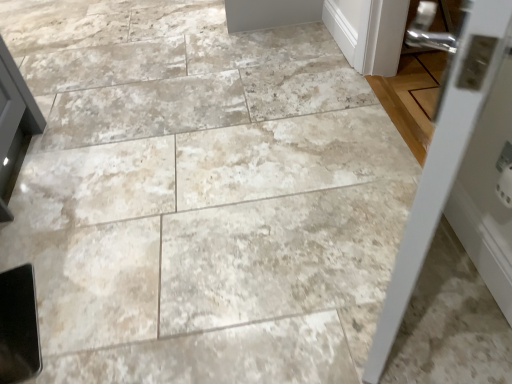
This screenshot has width=512, height=384. In order to click on white glossy door at right, the first door from the front in this screenshot , I will do `click(463, 172)`.

Measure the distance between point (455, 160) and camera.

Point (455, 160) is 19.33 inches from camera.

What do you see at coordinates (463, 172) in the screenshot?
I see `white glossy door at right, the first door from the front` at bounding box center [463, 172].

This screenshot has height=384, width=512. Describe the element at coordinates (349, 27) in the screenshot. I see `white painted wood door at upper right, which is counted as the 2th door, starting from the bottom` at that location.

Find the location of `white painted wood door at upper right, positioned as the 1th door in back-to-front order`. white painted wood door at upper right, positioned as the 1th door in back-to-front order is located at coordinates (349, 27).

Looking at this image, measure the distance between point (349, 0) and camera.

6.67 feet.

At what (x,y) coordinates should I click in order to perform the action: click on white glossy door at right, the 2th door in the back-to-front sequence. Please return your answer as a coordinate pair (x, y). Looking at the image, I should click on (463, 172).

Considering the relative positions of white glossy door at right, which is the second door from top to bottom, and white painted wood door at upper right, arranged as the 1th door when viewed from the top, in the image provided, is white glossy door at right, which is the second door from top to bottom, to the right of white painted wood door at upper right, arranged as the 1th door when viewed from the top, from the viewer's perspective?

No, white glossy door at right, which is the second door from top to bottom, is not to the right of white painted wood door at upper right, arranged as the 1th door when viewed from the top.

Is white glossy door at right, which is the second door from top to bottom, positioned before white painted wood door at upper right, which is the second door from front to back?

Yes, the depth of white glossy door at right, which is the second door from top to bottom, is less than that of white painted wood door at upper right, which is the second door from front to back.

Does point (469, 26) appear closer or farther from the camera than point (361, 53)?

Point (469, 26) is closer to the camera than point (361, 53).

From the image's perspective, is white glossy door at right, which is the second door from top to bottom, above or below white painted wood door at upper right, positioned as the 1th door in back-to-front order?

Based on their image positions, white glossy door at right, which is the second door from top to bottom, is located beneath white painted wood door at upper right, positioned as the 1th door in back-to-front order.

Consider the image. From a real-world perspective, relative to white painted wood door at upper right, arranged as the 1th door when viewed from the top, is white glossy door at right, acting as the first door starting from the bottom, vertically above or below?

Clearly, from a real-world perspective, white glossy door at right, acting as the first door starting from the bottom, is above white painted wood door at upper right, arranged as the 1th door when viewed from the top.

Considering the relative sizes of white glossy door at right, acting as the first door starting from the bottom, and white painted wood door at upper right, which is counted as the 2th door, starting from the bottom, in the image provided, is white glossy door at right, acting as the first door starting from the bottom, wider than white painted wood door at upper right, which is counted as the 2th door, starting from the bottom,?

Indeed, white glossy door at right, acting as the first door starting from the bottom, has a greater width compared to white painted wood door at upper right, which is counted as the 2th door, starting from the bottom.

Considering the relative sizes of white glossy door at right, acting as the first door starting from the bottom, and white painted wood door at upper right, which is the second door from front to back, in the image provided, is white glossy door at right, acting as the first door starting from the bottom, taller than white painted wood door at upper right, which is the second door from front to back,?

Yes, white glossy door at right, acting as the first door starting from the bottom, is taller than white painted wood door at upper right, which is the second door from front to back.

Considering the relative sizes of white glossy door at right, which is the second door from top to bottom, and white painted wood door at upper right, which is counted as the 2th door, starting from the bottom, in the image provided, is white glossy door at right, which is the second door from top to bottom, bigger than white painted wood door at upper right, which is counted as the 2th door, starting from the bottom,?

Yes.

Is white glossy door at right, acting as the first door starting from the bottom, outside of white painted wood door at upper right, which is the second door from front to back?

Yes.

Looking at this image, is white glossy door at right, which is the second door from top to bottom, far away from white painted wood door at upper right, positioned as the 1th door in back-to-front order?

Yes, white glossy door at right, which is the second door from top to bottom, and white painted wood door at upper right, positioned as the 1th door in back-to-front order, are quite far apart.

Does white glossy door at right, the 2th door in the back-to-front sequence, turn towards white painted wood door at upper right, positioned as the 1th door in back-to-front order?

No, white glossy door at right, the 2th door in the back-to-front sequence, is not facing towards white painted wood door at upper right, positioned as the 1th door in back-to-front order.

How many degrees apart are the facing directions of white glossy door at right, which is the second door from top to bottom, and white painted wood door at upper right, arranged as the 1th door when viewed from the top?

31.2 degrees separate the facing orientations of white glossy door at right, which is the second door from top to bottom, and white painted wood door at upper right, arranged as the 1th door when viewed from the top.

Could you measure the distance between white glossy door at right, which is the second door from top to bottom, and white painted wood door at upper right, positioned as the 1th door in back-to-front order?

The distance of white glossy door at right, which is the second door from top to bottom, from white painted wood door at upper right, positioned as the 1th door in back-to-front order, is 3.72 feet.

This screenshot has width=512, height=384. Identify the location of door positioned vertically above the white painted wood door at upper right, positioned as the 1th door in back-to-front order (from a real-world perspective). (463, 172).

Can you confirm if white painted wood door at upper right, arranged as the 1th door when viewed from the top, is positioned to the right of white glossy door at right, the 2th door in the back-to-front sequence?

Yes.

Which object is further away from the camera taking this photo, white painted wood door at upper right, arranged as the 1th door when viewed from the top, or white glossy door at right, which is the second door from top to bottom?

white painted wood door at upper right, arranged as the 1th door when viewed from the top, is more distant.

Considering the points (361, 18) and (485, 210), which point is in front, point (361, 18) or point (485, 210)?

The point (485, 210) is closer to the camera.

From the image's perspective, is white painted wood door at upper right, positioned as the 1th door in back-to-front order, below white glossy door at right, which is the second door from top to bottom?

No.

From a real-world perspective, does white painted wood door at upper right, which is counted as the 2th door, starting from the bottom, stand above white glossy door at right, acting as the first door starting from the bottom?

No, from a real-world perspective, white painted wood door at upper right, which is counted as the 2th door, starting from the bottom, is not above white glossy door at right, acting as the first door starting from the bottom.

Can you confirm if white painted wood door at upper right, which is counted as the 2th door, starting from the bottom, is thinner than white glossy door at right, the 2th door in the back-to-front sequence?

Yes, white painted wood door at upper right, which is counted as the 2th door, starting from the bottom, is thinner than white glossy door at right, the 2th door in the back-to-front sequence.

From their relative heights in the image, would you say white painted wood door at upper right, arranged as the 1th door when viewed from the top, is taller or shorter than white glossy door at right, acting as the first door starting from the bottom?

white painted wood door at upper right, arranged as the 1th door when viewed from the top, is shorter than white glossy door at right, acting as the first door starting from the bottom.

Looking at the image, does white painted wood door at upper right, arranged as the 1th door when viewed from the top, seem bigger or smaller compared to white glossy door at right, which is the second door from top to bottom?

Clearly, white painted wood door at upper right, arranged as the 1th door when viewed from the top, is smaller in size than white glossy door at right, which is the second door from top to bottom.

Is white painted wood door at upper right, which is the second door from front to back, surrounding white glossy door at right, which is the second door from top to bottom?

Actually, white glossy door at right, which is the second door from top to bottom, is outside white painted wood door at upper right, which is the second door from front to back.

Looking at this image, are white painted wood door at upper right, arranged as the 1th door when viewed from the top, and white glossy door at right, the first door from the front, located far from each other?

Yes, white painted wood door at upper right, arranged as the 1th door when viewed from the top, and white glossy door at right, the first door from the front, are quite far apart.

Is white painted wood door at upper right, which is counted as the 2th door, starting from the bottom, facing towards white glossy door at right, the 2th door in the back-to-front sequence?

No, white painted wood door at upper right, which is counted as the 2th door, starting from the bottom, is not oriented towards white glossy door at right, the 2th door in the back-to-front sequence.

From the picture: How different are the orientations of white painted wood door at upper right, which is counted as the 2th door, starting from the bottom, and white glossy door at right, which is the second door from top to bottom, in degrees?

31.2 degrees.

How far apart are white painted wood door at upper right, which is the second door from front to back, and white glossy door at right, acting as the first door starting from the bottom?

white painted wood door at upper right, which is the second door from front to back, and white glossy door at right, acting as the first door starting from the bottom, are 1.13 meters apart from each other.

This screenshot has width=512, height=384. What are the coordinates of `door lying above the white glossy door at right, the 2th door in the back-to-front sequence (from the image's perspective)` in the screenshot? It's located at (349, 27).

At what (x,y) coordinates should I click in order to perform the action: click on door behind the white glossy door at right, which is the second door from top to bottom. Please return your answer as a coordinate pair (x, y). The height and width of the screenshot is (384, 512). Looking at the image, I should click on (349, 27).

You are a GUI agent. You are given a task and a screenshot of the screen. Output one action in this format:
    pyautogui.click(x=<x>, y=<y>)
    Task: Click on the door that is on the right side of white glossy door at right, the first door from the front
    This screenshot has height=384, width=512.
    Given the screenshot: What is the action you would take?
    pyautogui.click(x=349, y=27)